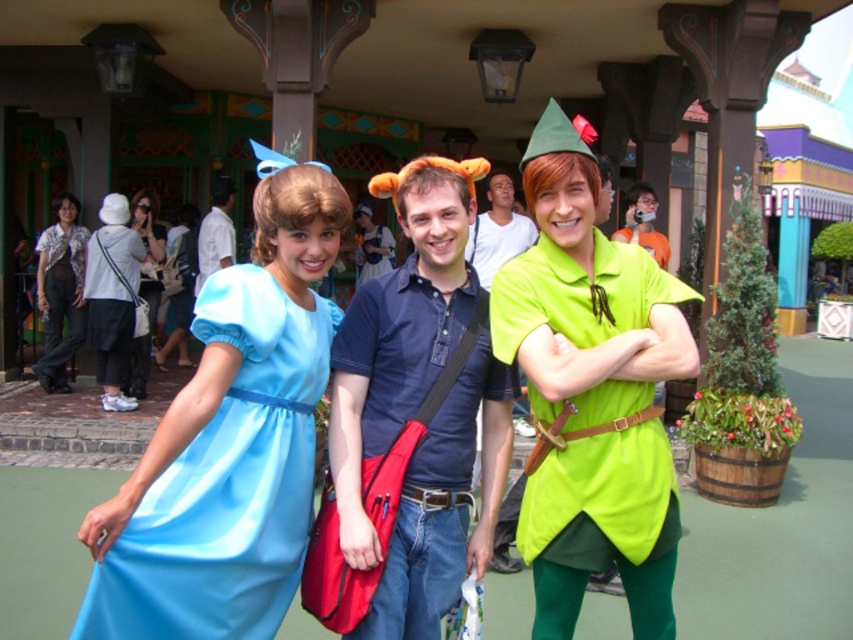
You are a photographer at the theme park and want to take a group photo of the dark blue cotton shirt at center and the matte blue shirt at center. The minimum distance required for your camera to focus properly is 4 meters. Will you need to adjust their positions to ensure the camera can focus?

The dark blue cotton shirt at center and the matte blue shirt at center are 3.87 meters apart, which is less than the 4 meters required for proper focus. Therefore, you will need to ask them to move further apart to ensure the camera can focus properly.